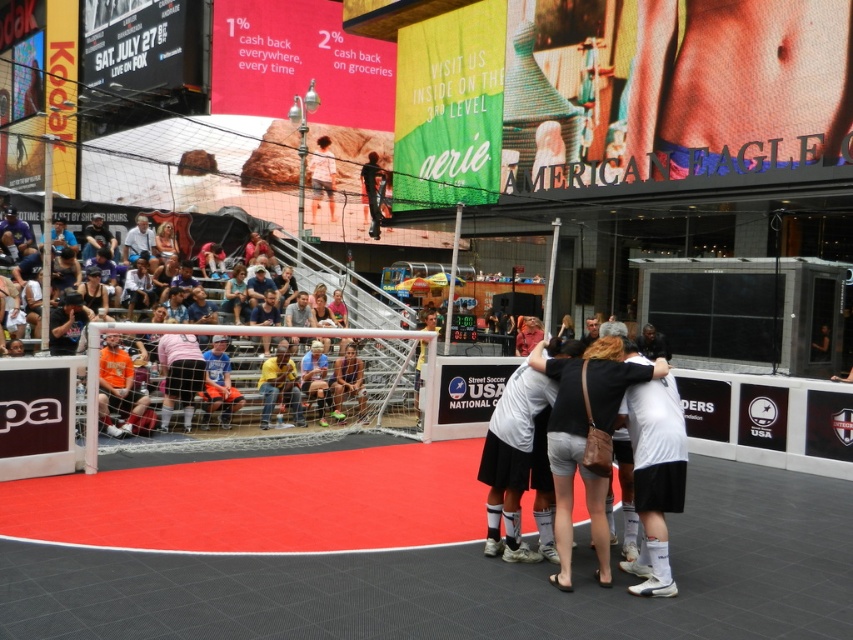
Question: Which object is the farthest from the dark blue jeans at upper center?

Choices:
 (A) light brown leather jacket at center
 (B) orange fabric seats at lower left

Answer: (B)

Question: Is light brown leather jacket at center below dark blue jeans at upper center?

Choices:
 (A) no
 (B) yes

Answer: (A)

Question: Which of these objects is positioned farthest from the orange fabric seats at lower left?

Choices:
 (A) light brown leather jacket at center
 (B) dark blue jeans at upper center

Answer: (A)

Question: Can you confirm if orange fabric seats at lower left is positioned above light brown leather jacket at center?

Choices:
 (A) no
 (B) yes

Answer: (A)

Question: Which point is farther to the camera?

Choices:
 (A) orange fabric seats at lower left
 (B) dark blue jeans at upper center

Answer: (B)

Question: Is orange fabric seats at lower left thinner than light brown leather jacket at center?

Choices:
 (A) yes
 (B) no

Answer: (A)